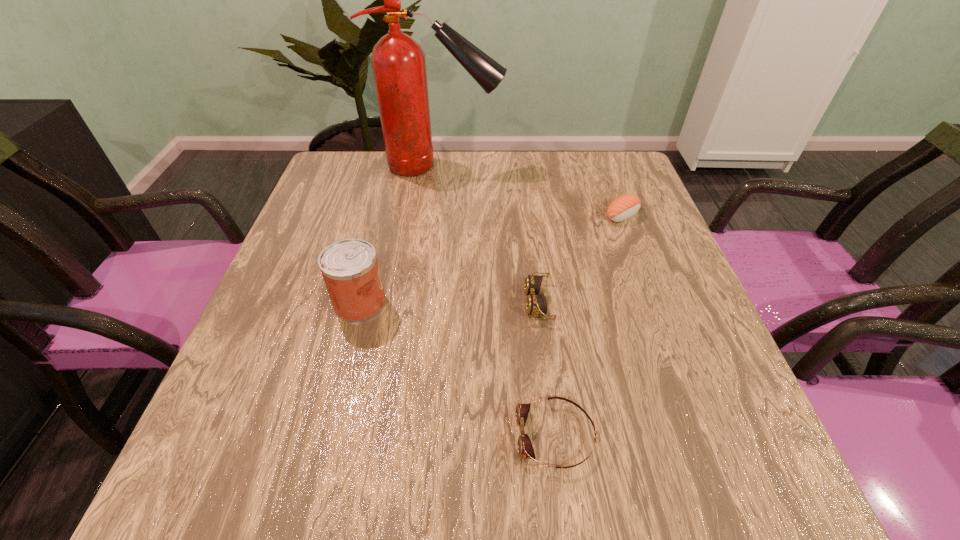
You are a GUI agent. You are given a task and a screenshot of the screen. Output one action in this format:
    pyautogui.click(x=<x>, y=<y>)
    Task: Click on the vacant area that lies between the farthest object and the fourth shortest object
    This screenshot has height=540, width=960.
    Given the screenshot: What is the action you would take?
    pyautogui.click(x=400, y=234)

Where is `the fourth closest object to the taller goggles`? Image resolution: width=960 pixels, height=540 pixels. the fourth closest object to the taller goggles is located at coordinates (398, 62).

Where is `object that is the second closest to the second shortest object`? This screenshot has width=960, height=540. object that is the second closest to the second shortest object is located at coordinates (625, 206).

Where is `vacant space that satisfies the following two spatial constraints: 1. on the back side of the second tallest object; 2. on the right side of the fourth nearest object`? Image resolution: width=960 pixels, height=540 pixels. vacant space that satisfies the following two spatial constraints: 1. on the back side of the second tallest object; 2. on the right side of the fourth nearest object is located at coordinates (382, 215).

Find the location of `blank space that satisfies the following two spatial constraints: 1. at the nozzle end of the rightmost object; 2. on the left side of the farthest object`. blank space that satisfies the following two spatial constraints: 1. at the nozzle end of the rightmost object; 2. on the left side of the farthest object is located at coordinates (434, 215).

Where is `blank area in the image that satisfies the following two spatial constraints: 1. at the nozzle end of the fire extinguisher; 2. on the left side of the rightmost object`? blank area in the image that satisfies the following two spatial constraints: 1. at the nozzle end of the fire extinguisher; 2. on the left side of the rightmost object is located at coordinates (434, 215).

Locate an element on the screen. vacant space that satisfies the following two spatial constraints: 1. at the nozzle end of the tallest object; 2. on the front side of the can is located at coordinates (423, 303).